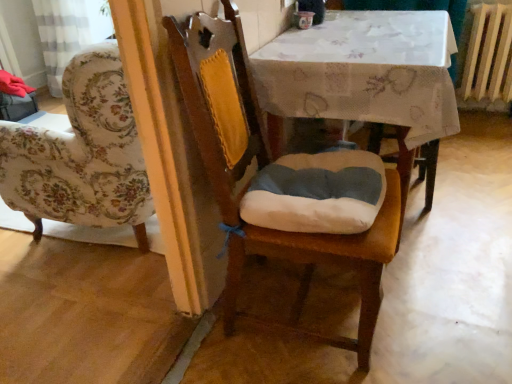
Identify the location of vacant space underneath wooden chair at center (from a real-world perspective). This screenshot has height=384, width=512. (303, 302).